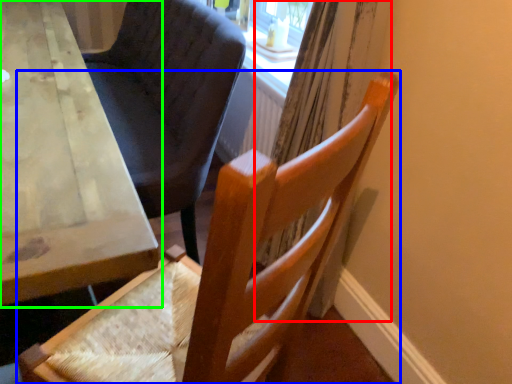
Question: Estimate the real-world distances between objects in this image. Which object is farther from curtain (highlighted by a red box), chair (highlighted by a blue box) or table (highlighted by a green box)?

Choices:
 (A) chair
 (B) table

Answer: (B)